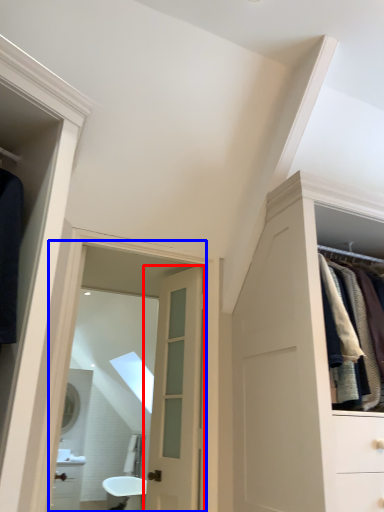
Question: Which object is further to the camera taking this photo, door (highlighted by a red box) or mirror (highlighted by a blue box)?

Choices:
 (A) door
 (B) mirror

Answer: (A)